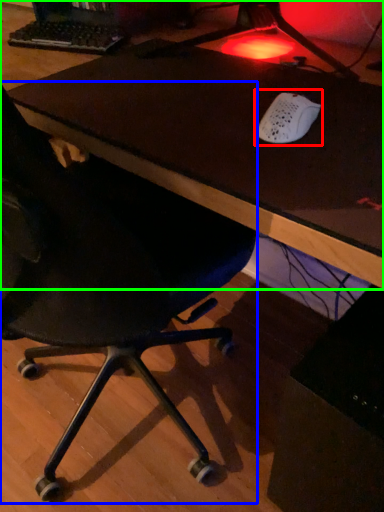
Question: Which object is the closest to the mouse (highlighted by a red box)? Choose among these: chair (highlighted by a blue box) or table (highlighted by a green box).

Choices:
 (A) chair
 (B) table

Answer: (B)